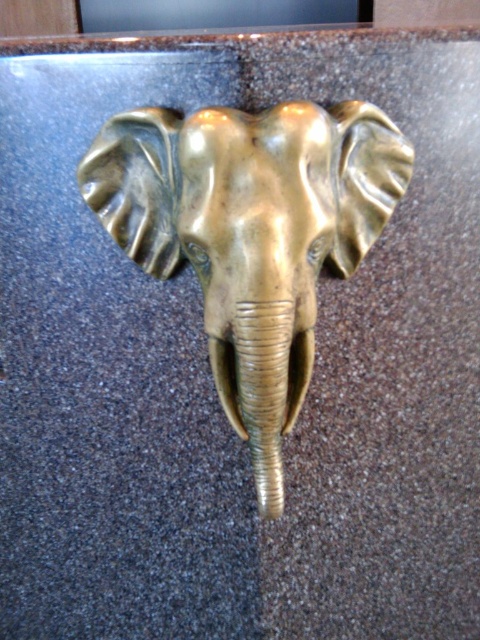
Question: In this image, where is gold polished elephant head at center located relative to gold textured tusk at center?

Choices:
 (A) above
 (B) below

Answer: (A)

Question: Can you confirm if gold polished elephant head at center is bigger than gold textured tusk at center?

Choices:
 (A) no
 (B) yes

Answer: (B)

Question: Can you confirm if gold polished elephant head at center is thinner than gold textured tusk at center?

Choices:
 (A) no
 (B) yes

Answer: (A)